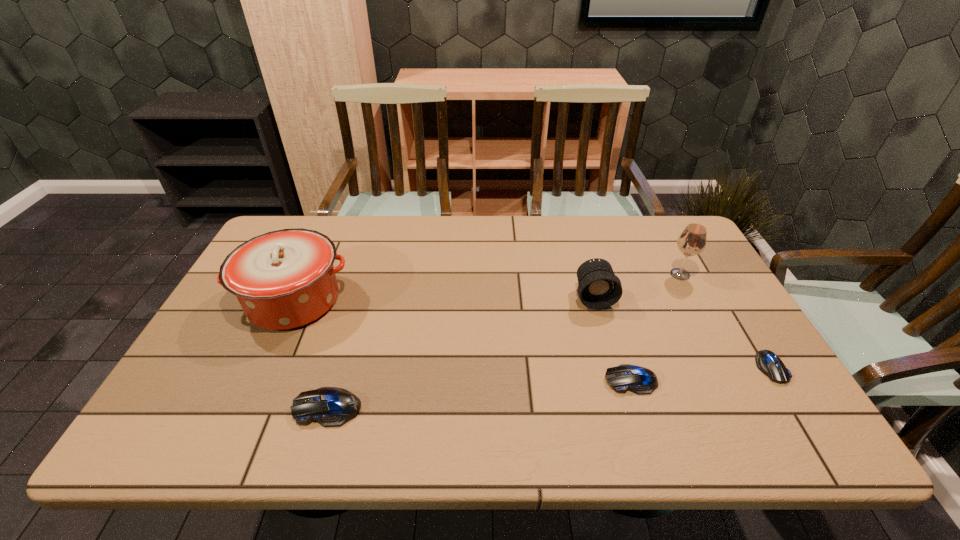
This screenshot has height=540, width=960. I want to click on the third shortest object, so click(x=329, y=406).

The height and width of the screenshot is (540, 960). I want to click on the tallest computer mouse, so click(x=329, y=406).

Where is `the second tallest computer mouse`? The height and width of the screenshot is (540, 960). the second tallest computer mouse is located at coordinates (626, 377).

Locate an element on the screen. The width and height of the screenshot is (960, 540). the second computer mouse from right to left is located at coordinates (626, 377).

You are a GUI agent. You are given a task and a screenshot of the screen. Output one action in this format:
    pyautogui.click(x=<x>, y=<y>)
    Task: Click on the shortest computer mouse
    
    Given the screenshot: What is the action you would take?
    pyautogui.click(x=767, y=362)

Locate an element on the screen. Image resolution: width=960 pixels, height=540 pixels. the rightmost computer mouse is located at coordinates (767, 362).

You are a GUI agent. You are given a task and a screenshot of the screen. Output one action in this format:
    pyautogui.click(x=<x>, y=<y>)
    Task: Click on the wineglass
    The height and width of the screenshot is (540, 960).
    Given the screenshot: What is the action you would take?
    pyautogui.click(x=692, y=241)

This screenshot has height=540, width=960. What are the coordinates of `casserole` in the screenshot? It's located at (285, 279).

In order to click on the fourth shortest object in this screenshot , I will do `click(598, 287)`.

Find the location of a particular element. Image resolution: width=960 pixels, height=540 pixels. vacant space located 0.220m on the button side of the tallest computer mouse is located at coordinates (196, 408).